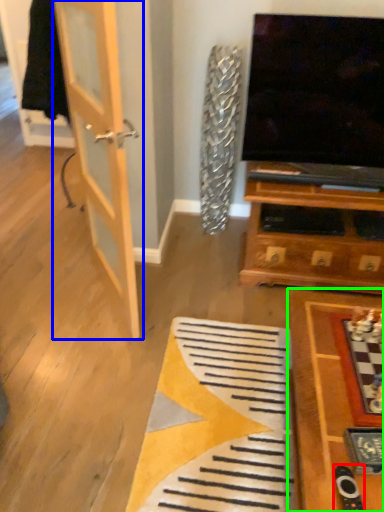
Question: Based on their relative distances, which object is nearer to remote (highlighted by a red box)? Choose from door (highlighted by a blue box) and table (highlighted by a green box).

Choices:
 (A) door
 (B) table

Answer: (B)